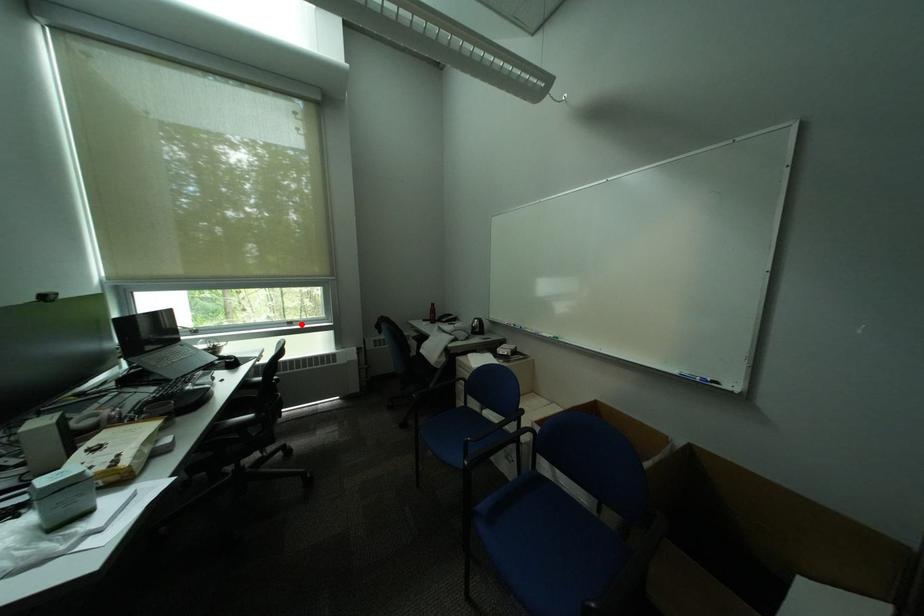
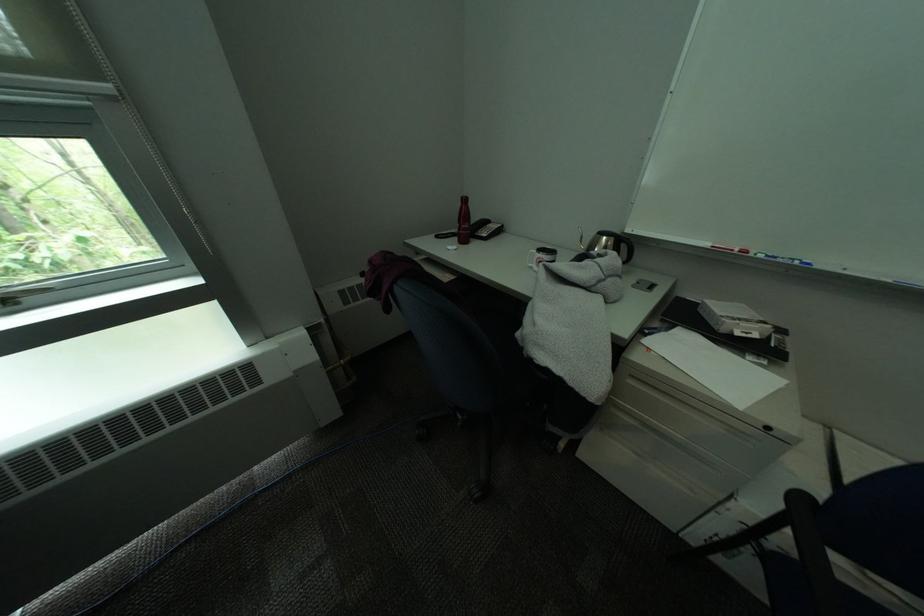
The point at the highlighted location is marked in the first image. Where is the corresponding point in the second image?

(15, 302)